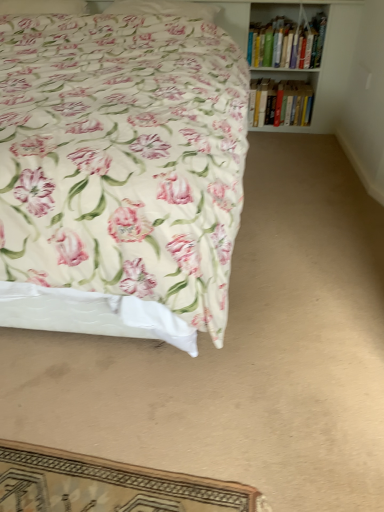
Question: In terms of width, does floral fabric pillow at upper center, the 2th pillow from the left, look wider or thinner when compared to hardcover books at upper right, arranged as the first book when ordered from the bottom?

Choices:
 (A) thin
 (B) wide

Answer: (A)

Question: In terms of height, does floral fabric pillow at upper center, the 2th pillow from the left, look taller or shorter compared to hardcover books at upper right, the 2th book viewed from the top?

Choices:
 (A) tall
 (B) short

Answer: (B)

Question: Considering the real-world distances, which object is farthest from the floral fabric pillow at upper left, arranged as the 1th pillow when viewed from the left?

Choices:
 (A) hardcover books at upper right, the 2th book viewed from the top
 (B) floral fabric pillow at upper center, the first pillow viewed from the right
 (C) hardcover books at upper right, acting as the 1th book starting from the top
 (D) floral fabric bed at upper left

Answer: (A)

Question: Which object is positioned closest to the floral fabric pillow at upper center, the 2th pillow from the left?

Choices:
 (A) floral fabric bed at upper left
 (B) floral fabric pillow at upper left, the second pillow in the right-to-left sequence
 (C) hardcover books at upper right, the 2th book viewed from the top
 (D) hardcover books at upper right, which appears as the second book when ordered from the bottom

Answer: (B)